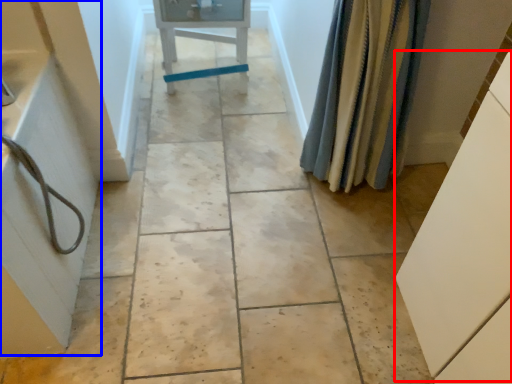
Question: Which object is closer to the camera taking this photo, cabinetry (highlighted by a red box) or bath (highlighted by a blue box)?

Choices:
 (A) cabinetry
 (B) bath

Answer: (A)